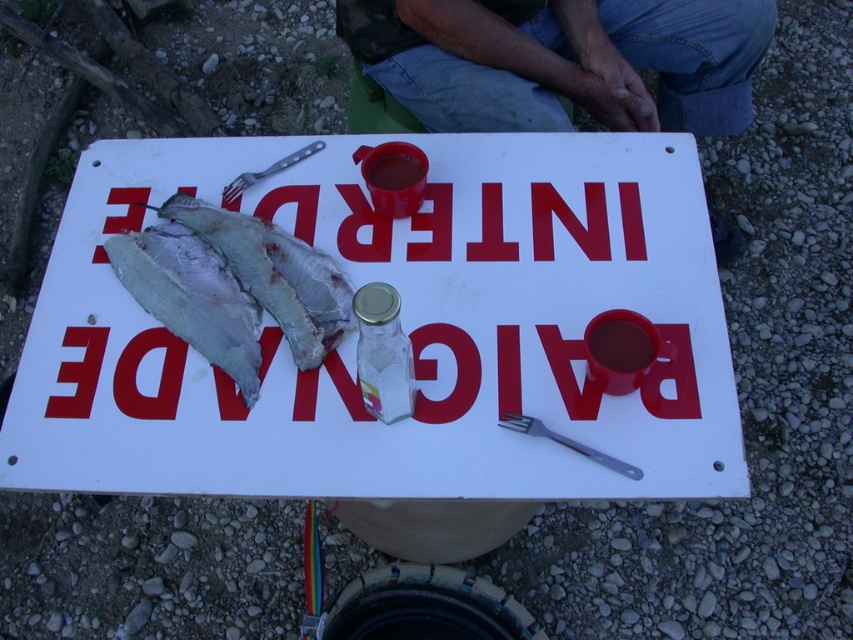
Question: Can you confirm if jeans at upper center is positioned to the left of white flaky fish at center?

Choices:
 (A) no
 (B) yes

Answer: (A)

Question: Is white plastic sign at center to the left of metallic silver fork at lower right from the viewer's perspective?

Choices:
 (A) yes
 (B) no

Answer: (A)

Question: Can you confirm if white plastic sign at center is thinner than metallic silver fork at lower right?

Choices:
 (A) yes
 (B) no

Answer: (B)

Question: Among these objects, which one is nearest to the camera?

Choices:
 (A) metallic silver fork at lower right
 (B) white plastic sign at center
 (C) white flaky fish at center
 (D) silver metallic fork at upper left

Answer: (B)

Question: Which object is farther from the camera taking this photo?

Choices:
 (A) silver metallic fork at upper left
 (B) white plastic sign at center
 (C) metallic silver fork at lower right

Answer: (A)

Question: Which is farther from the jeans at upper center?

Choices:
 (A) silver metallic fork at upper left
 (B) metallic silver fork at lower right
 (C) white flaky fish at center

Answer: (B)